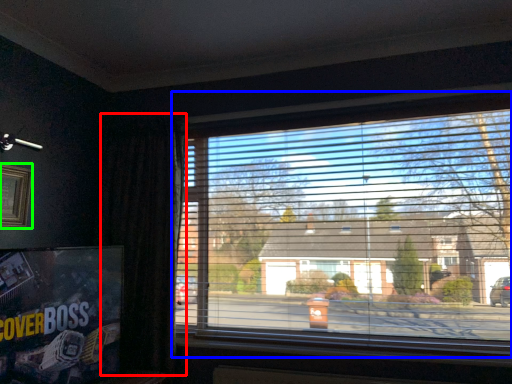
Question: Considering the real-world distances, which object is closest to curtain (highlighted by a red box)? window (highlighted by a blue box) or picture frame (highlighted by a green box).

Choices:
 (A) window
 (B) picture frame

Answer: (B)